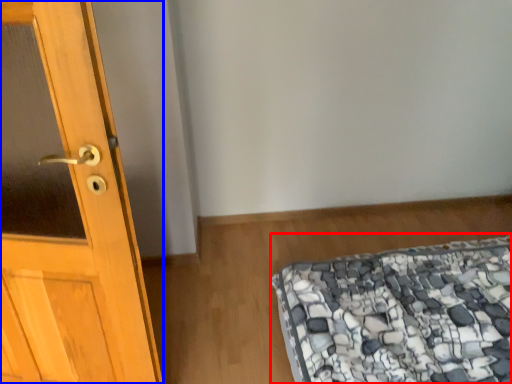
Question: Which object is closer to the camera taking this photo, mattress (highlighted by a red box) or door (highlighted by a blue box)?

Choices:
 (A) mattress
 (B) door

Answer: (B)